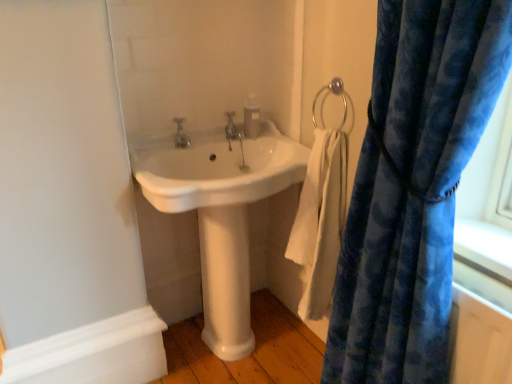
Question: Considering the relative sizes of white cotton towel at lower right and velvety blue curtain at right in the image provided, is white cotton towel at lower right shorter than velvety blue curtain at right?

Choices:
 (A) yes
 (B) no

Answer: (A)

Question: Is white cotton towel at lower right outside of velvety blue curtain at right?

Choices:
 (A) no
 (B) yes

Answer: (B)

Question: Does white cotton towel at lower right appear on the right side of velvety blue curtain at right?

Choices:
 (A) yes
 (B) no

Answer: (B)

Question: Can you confirm if white cotton towel at lower right is taller than velvety blue curtain at right?

Choices:
 (A) no
 (B) yes

Answer: (A)

Question: Would you consider white cotton towel at lower right to be distant from velvety blue curtain at right?

Choices:
 (A) no
 (B) yes

Answer: (A)

Question: Considering the positions of point (256, 183) and point (178, 135), is point (256, 183) closer or farther from the camera than point (178, 135)?

Choices:
 (A) closer
 (B) farther

Answer: (A)

Question: From the image's perspective, is white glossy sink at center located above or below matte silver faucet at center, which is the second tap from right to left?

Choices:
 (A) below
 (B) above

Answer: (A)

Question: In the image, is white glossy sink at center positioned in front of or behind matte silver faucet at center, which is the first tap from front to back?

Choices:
 (A) front
 (B) behind

Answer: (A)

Question: In terms of width, does white glossy sink at center look wider or thinner when compared to matte silver faucet at center, marked as the 1th tap in a left-to-right arrangement?

Choices:
 (A) thin
 (B) wide

Answer: (B)

Question: Relative to polished chrome faucet at center, positioned as the 2th tap in left-to-right order, is white cotton towel at lower right in front or behind?

Choices:
 (A) behind
 (B) front

Answer: (B)

Question: From a real-world perspective, is white cotton towel at lower right positioned above or below polished chrome faucet at center, arranged as the 2th tap when viewed from the front?

Choices:
 (A) below
 (B) above

Answer: (A)

Question: In terms of width, does white cotton towel at lower right look wider or thinner when compared to polished chrome faucet at center, positioned as the 2th tap in left-to-right order?

Choices:
 (A) wide
 (B) thin

Answer: (A)

Question: Is white cotton towel at lower right spatially inside polished chrome faucet at center, the first tap from the right, or outside of it?

Choices:
 (A) inside
 (B) outside

Answer: (B)

Question: From the image's perspective, relative to white cotton towel at lower right, is translucent plastic soap dispenser at upper center above or below?

Choices:
 (A) below
 (B) above

Answer: (B)

Question: Would you say translucent plastic soap dispenser at upper center is inside or outside white cotton towel at lower right?

Choices:
 (A) outside
 (B) inside

Answer: (A)